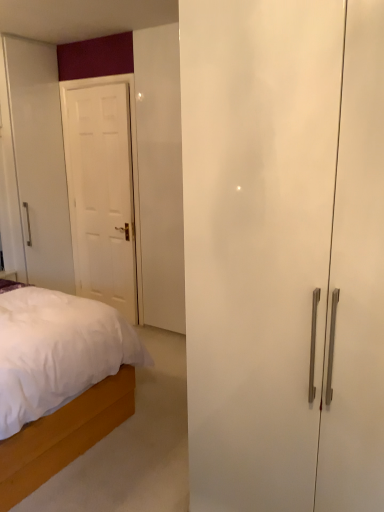
The width and height of the screenshot is (384, 512). What are the coordinates of `white glossy door at left` in the screenshot? It's located at (101, 193).

What do you see at coordinates (101, 193) in the screenshot?
I see `white glossy door at left` at bounding box center [101, 193].

The height and width of the screenshot is (512, 384). What do you see at coordinates (63, 436) in the screenshot?
I see `white wooden bed at lower left` at bounding box center [63, 436].

Find the location of a particular element. white wooden bed at lower left is located at coordinates tap(63, 436).

Identify the location of white glossy door at left. The image size is (384, 512). (101, 193).

In the image, is white glossy door at left on the left side or the right side of white wooden bed at lower left?

white glossy door at left is to the right of white wooden bed at lower left.

Does white glossy door at left lie in front of white wooden bed at lower left?

No, the depth of white glossy door at left is greater than that of white wooden bed at lower left.

Considering the positions of points (107, 243) and (8, 478), is point (107, 243) closer to camera compared to point (8, 478)?

That is False.

From the image's perspective, which one is positioned lower, white glossy door at left or white wooden bed at lower left?

From the image's view, white wooden bed at lower left is below.

From a real-world perspective, which is physically above, white glossy door at left or white wooden bed at lower left?

white glossy door at left.

Looking at their sizes, would you say white glossy door at left is wider or thinner than white wooden bed at lower left?

white glossy door at left is thinner than white wooden bed at lower left.

Considering the relative sizes of white glossy door at left and white wooden bed at lower left in the image provided, is white glossy door at left taller than white wooden bed at lower left?

Correct, white glossy door at left is much taller as white wooden bed at lower left.

Looking at this image, does white glossy door at left have a smaller size compared to white wooden bed at lower left?

Correct, white glossy door at left occupies less space than white wooden bed at lower left.

Is white glossy door at left surrounding white wooden bed at lower left?

No, white wooden bed at lower left is not a part of white glossy door at left.

Is white glossy door at left next to white wooden bed at lower left and touching it?

white glossy door at left is not next to white wooden bed at lower left, and they're not touching.

Is white glossy door at left aimed at white wooden bed at lower left?

Yes.

Looking at this image, how many degrees apart are the facing directions of white glossy door at left and white wooden bed at lower left?

They differ by 91.3 degrees in their facing directions.

Consider the image. How distant is white glossy door at left from white wooden bed at lower left?

A distance of 1.74 meters exists between white glossy door at left and white wooden bed at lower left.

Image resolution: width=384 pixels, height=512 pixels. Find the location of `bed in front of the white glossy door at left`. bed in front of the white glossy door at left is located at coordinates (63, 436).

Considering the relative positions of white wooden bed at lower left and white glossy door at left in the image provided, is white wooden bed at lower left to the left or to the right of white glossy door at left?

Based on their positions, white wooden bed at lower left is located to the left of white glossy door at left.

Based on the photo, considering their positions, is white wooden bed at lower left located in front of or behind white glossy door at left?

Clearly, white wooden bed at lower left is in front of white glossy door at left.

Does point (31, 435) lie behind point (128, 101)?

That is False.

From the image's perspective, which is above, white wooden bed at lower left or white glossy door at left?

white glossy door at left.

From a real-world perspective, is white wooden bed at lower left under white glossy door at left?

→ Yes, from a real-world perspective, white wooden bed at lower left is below white glossy door at left.

Can you confirm if white wooden bed at lower left is wider than white glossy door at left?

Correct, the width of white wooden bed at lower left exceeds that of white glossy door at left.

Which of these two, white wooden bed at lower left or white glossy door at left, stands taller?

With more height is white glossy door at left.

Is white wooden bed at lower left bigger or smaller than white glossy door at left?

Clearly, white wooden bed at lower left is larger in size than white glossy door at left.

Is white wooden bed at lower left positioned beyond the bounds of white glossy door at left?

Yes, white wooden bed at lower left is located beyond the bounds of white glossy door at left.

Is white wooden bed at lower left not close to white glossy door at left?

Absolutely, white wooden bed at lower left is distant from white glossy door at left.

Is white wooden bed at lower left turned away from white glossy door at left?

No, white wooden bed at lower left is not facing away from white glossy door at left.

What's the angular difference between white wooden bed at lower left and white glossy door at left's facing directions?

white wooden bed at lower left and white glossy door at left are facing 91.3 degrees away from each other.

This screenshot has width=384, height=512. What are the coordinates of `door that appears behind the white wooden bed at lower left` in the screenshot? It's located at (101, 193).

Where is `bed below the white glossy door at left (from the image's perspective)`? The image size is (384, 512). bed below the white glossy door at left (from the image's perspective) is located at coordinates (63, 436).

Where is `bed located on the left of white glossy door at left`? The height and width of the screenshot is (512, 384). bed located on the left of white glossy door at left is located at coordinates (63, 436).